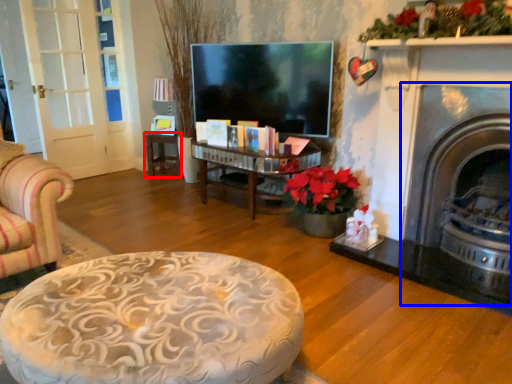
Question: Which object appears closest to the camera in this image, table (highlighted by a red box) or fireplace (highlighted by a blue box)?

Choices:
 (A) table
 (B) fireplace

Answer: (B)